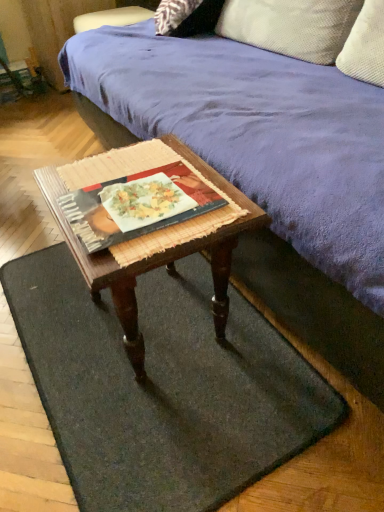
The width and height of the screenshot is (384, 512). In order to click on vacant space behind matte black book at center in this screenshot , I will do `click(143, 158)`.